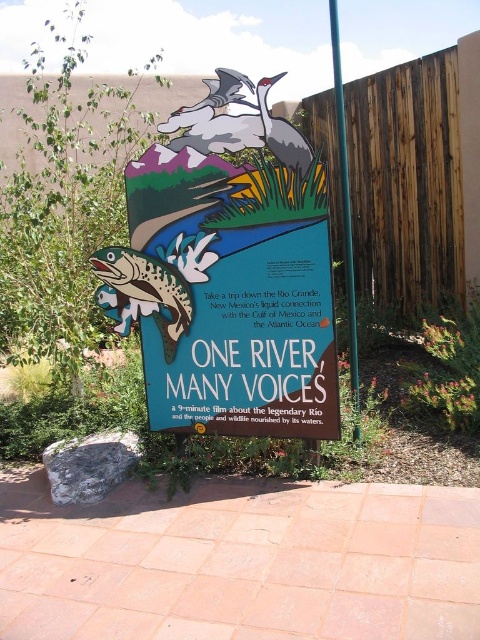
Question: Among these points, which one is farthest from the camera?

Choices:
 (A) (187, 294)
 (B) (336, 42)

Answer: (B)

Question: Which object appears farthest from the camera in this image?

Choices:
 (A) shiny metallic fish at center
 (B) matte green signboard at center

Answer: (A)

Question: Can you confirm if matte green signboard at center is wider than shiny metallic fish at center?

Choices:
 (A) yes
 (B) no

Answer: (A)

Question: Does shiny metallic fish at center appear on the right side of green painted wood pole at center?

Choices:
 (A) yes
 (B) no

Answer: (B)

Question: Which object is closer to the camera taking this photo?

Choices:
 (A) shiny metallic fish at center
 (B) matte green signboard at center
 (C) green painted wood pole at center

Answer: (B)

Question: Does matte green signboard at center lie behind green painted wood pole at center?

Choices:
 (A) no
 (B) yes

Answer: (A)